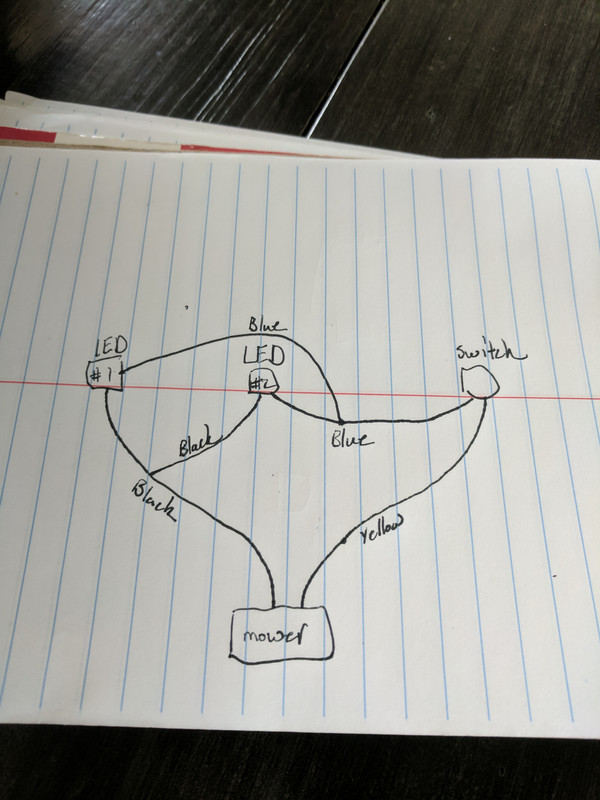
You are a GUI agent. You are given a task and a screenshot of the screen. Output one action in this format:
    pyautogui.click(x=<x>, y=<y>)
    Task: Click on the light reflecting off table
    This screenshot has height=800, width=600.
    Given the screenshot: What is the action you would take?
    pyautogui.click(x=120, y=29)